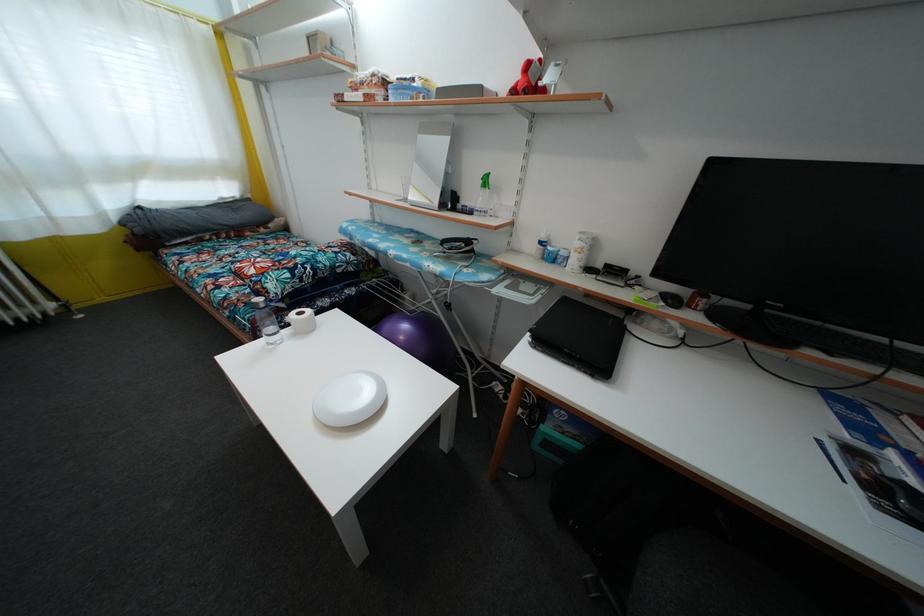
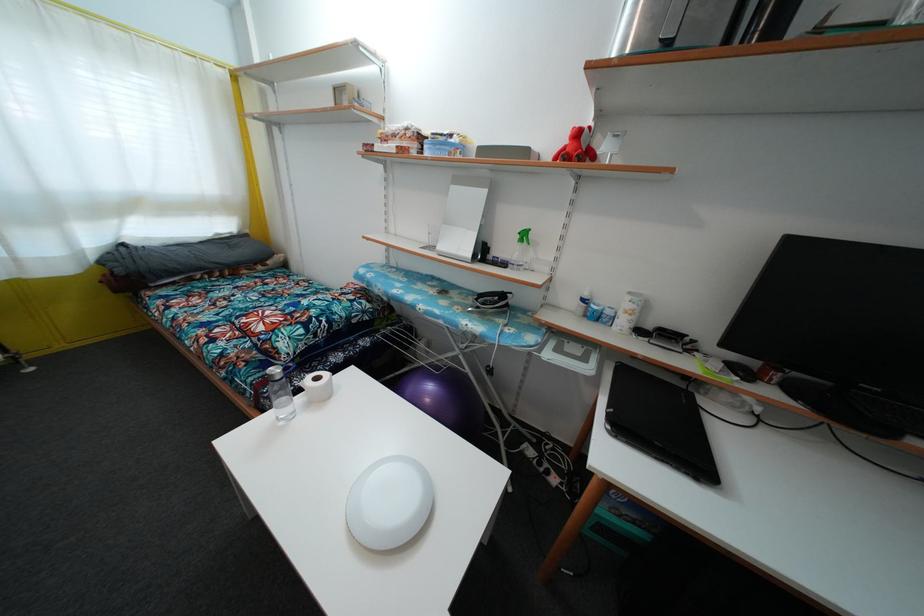
Where in the second image is the point corresponding to pixel 304 320 from the first image?

(321, 386)